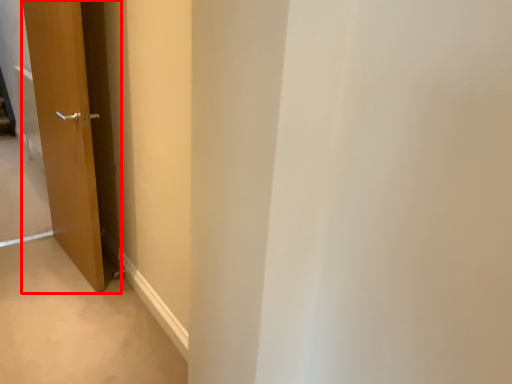
Question: From the image's perspective, considering the relative positions of door (annotated by the red box) and path in the image provided, where is door (annotated by the red box) located with respect to the staircase?

Choices:
 (A) below
 (B) above

Answer: (B)